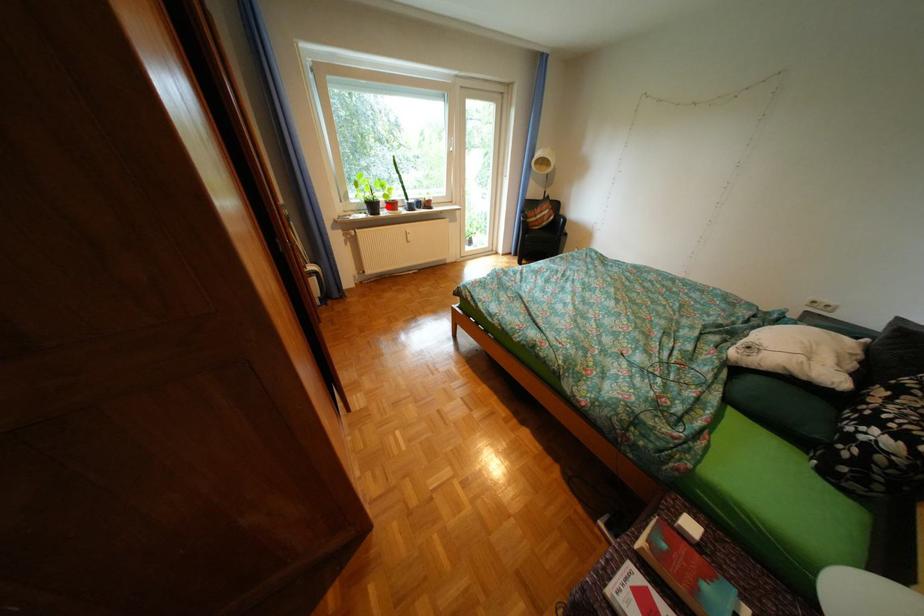
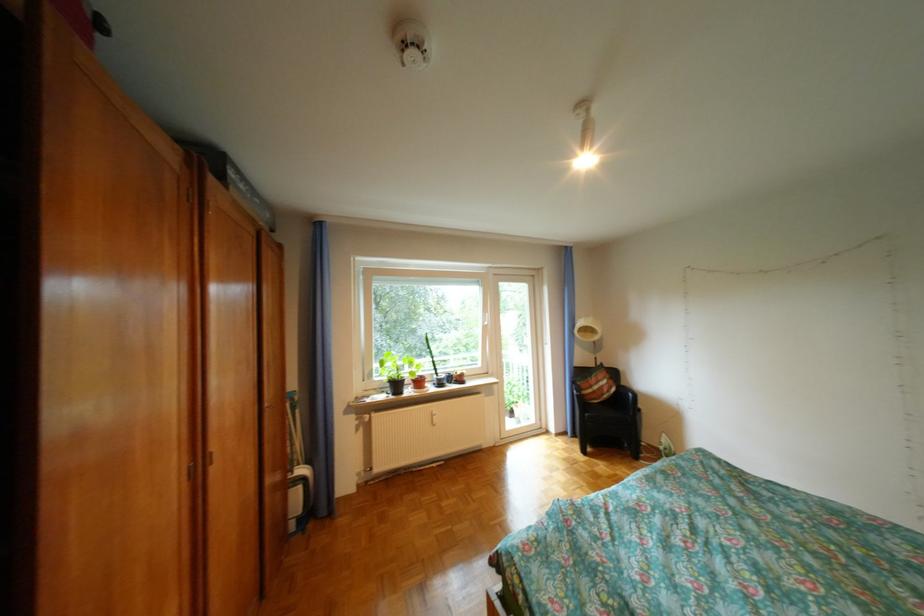
Question: I am providing you with two images of the same scene from different viewpoints. Image1 has a red point marked. In image2, the corresponding 3D location appears at what relative position? Reply with the corresponding letter.

Choices:
 (A) Closer
 (B) Farther

Answer: (B)